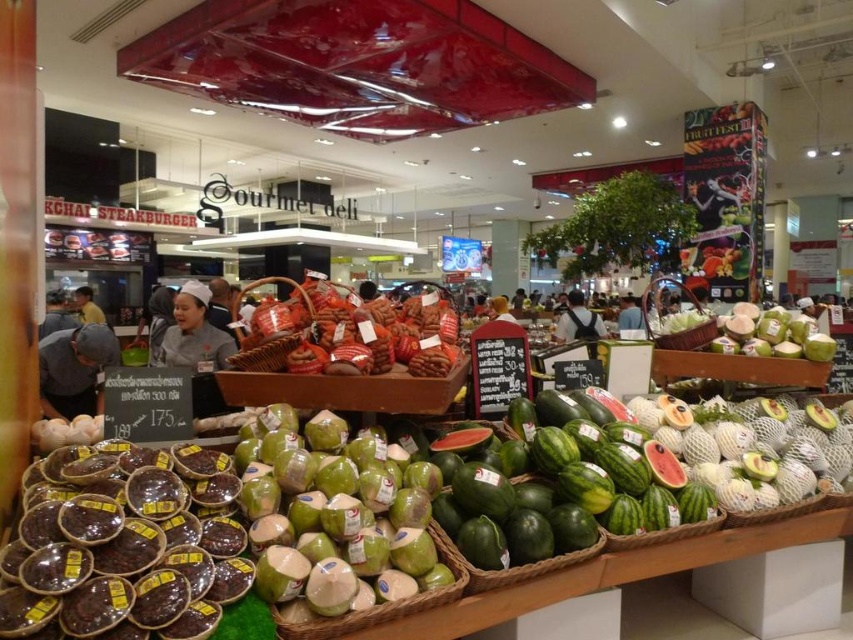
You are a customer at the market and want to buy a watermelon from the fruit stand. There are two employees nearby wearing the white uniform at center and the light blue shirt at center. Which employee should you approach based on their clothing size?

The white uniform at center is bigger than the light blue shirt at center, so you should approach the employee wearing the white uniform at center since their clothing size indicates they might be the supervisor or have a higher authority in the market.